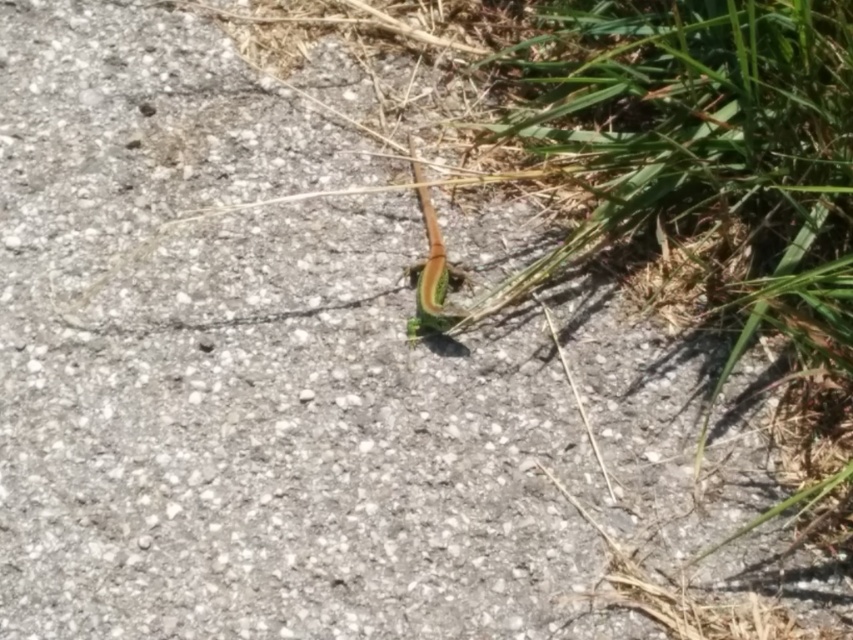
Question: Does green leafy grass at center appear under green matte grasshopper at center?

Choices:
 (A) yes
 (B) no

Answer: (A)

Question: Considering the relative positions of green leafy grass at center and green matte grasshopper at center in the image provided, where is green leafy grass at center located with respect to green matte grasshopper at center?

Choices:
 (A) right
 (B) left

Answer: (A)

Question: Which object is closer to the camera taking this photo?

Choices:
 (A) green matte grasshopper at center
 (B) green leafy grass at center

Answer: (B)

Question: Is green leafy grass at center closer to camera compared to green matte grasshopper at center?

Choices:
 (A) no
 (B) yes

Answer: (B)

Question: Which of the following is the closest to the observer?

Choices:
 (A) green matte grasshopper at center
 (B) green leafy grass at center

Answer: (B)